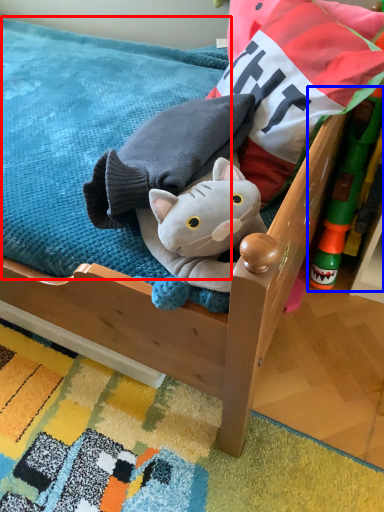
Question: Which object appears closest to the camera in this image, mattress (highlighted by a red box) or toy (highlighted by a blue box)?

Choices:
 (A) mattress
 (B) toy

Answer: (A)